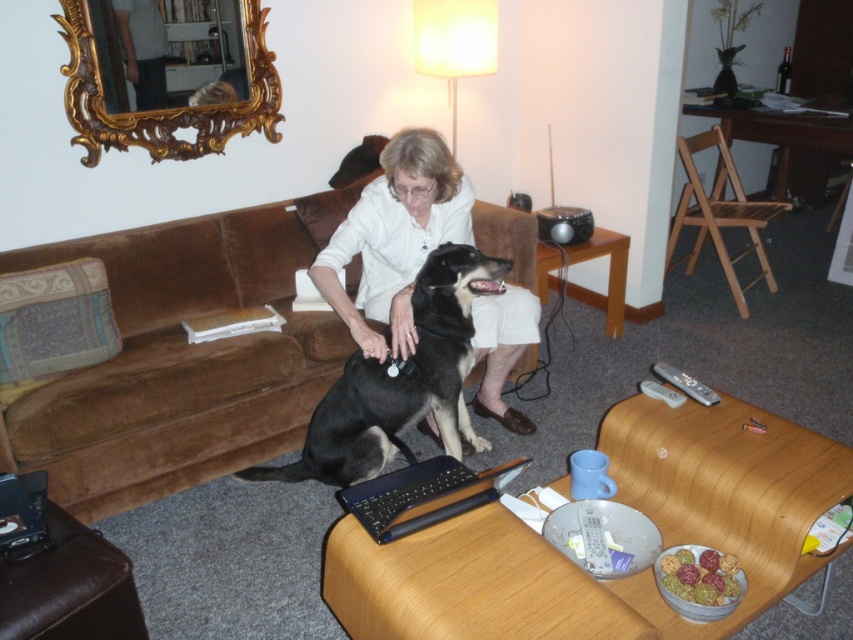
Consider the image. Can you confirm if black smooth dog at center is thinner than gold ornate mirror at upper left?

No.

Is point (315, 442) closer to viewer compared to point (132, 131)?

Yes.

This screenshot has height=640, width=853. Find the location of `black smooth dog at center`. black smooth dog at center is located at coordinates (399, 380).

Does black smooth dog at center have a lesser height compared to black plastic laptop at center?

No.

Does black smooth dog at center appear on the left side of black plastic laptop at center?

Yes, black smooth dog at center is to the left of black plastic laptop at center.

Describe the element at coordinates (399, 380) in the screenshot. The width and height of the screenshot is (853, 640). I see `black smooth dog at center` at that location.

The width and height of the screenshot is (853, 640). What are the coordinates of `black smooth dog at center` in the screenshot? It's located at (399, 380).

Between gold ornate mirror at upper left and black plastic laptop at center, which one appears on the right side from the viewer's perspective?

Positioned to the right is black plastic laptop at center.

Is gold ornate mirror at upper left above black plastic laptop at center?

Yes, gold ornate mirror at upper left is above black plastic laptop at center.

The height and width of the screenshot is (640, 853). Identify the location of gold ornate mirror at upper left. (163, 109).

The height and width of the screenshot is (640, 853). Identify the location of gold ornate mirror at upper left. (163, 109).